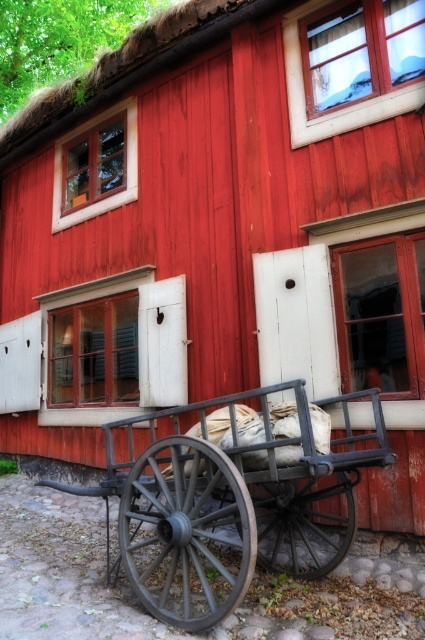
Does rustic wood wagon at lower center come behind dark gray wood wagon wheel at center?

A: No.

The width and height of the screenshot is (425, 640). Find the location of `rustic wood wagon at lower center`. rustic wood wagon at lower center is located at coordinates (229, 504).

I want to click on rustic wood wagon at lower center, so click(229, 504).

Is rustic wood wagon at lower center smaller than dark gray wooden wagon wheel at lower center?

No, rustic wood wagon at lower center is not smaller than dark gray wooden wagon wheel at lower center.

In the scene shown: Between rustic wood wagon at lower center and dark gray wooden wagon wheel at lower center, which one appears on the right side from the viewer's perspective?

rustic wood wagon at lower center

What are the coordinates of `rustic wood wagon at lower center` in the screenshot? It's located at tap(229, 504).

Is point (155, 448) more distant than point (266, 532)?

That is False.

Measure the distance between point (141, 550) and camera.

The distance of point (141, 550) from camera is 4.24 meters.

I want to click on dark gray wooden wagon wheel at lower center, so click(x=187, y=532).